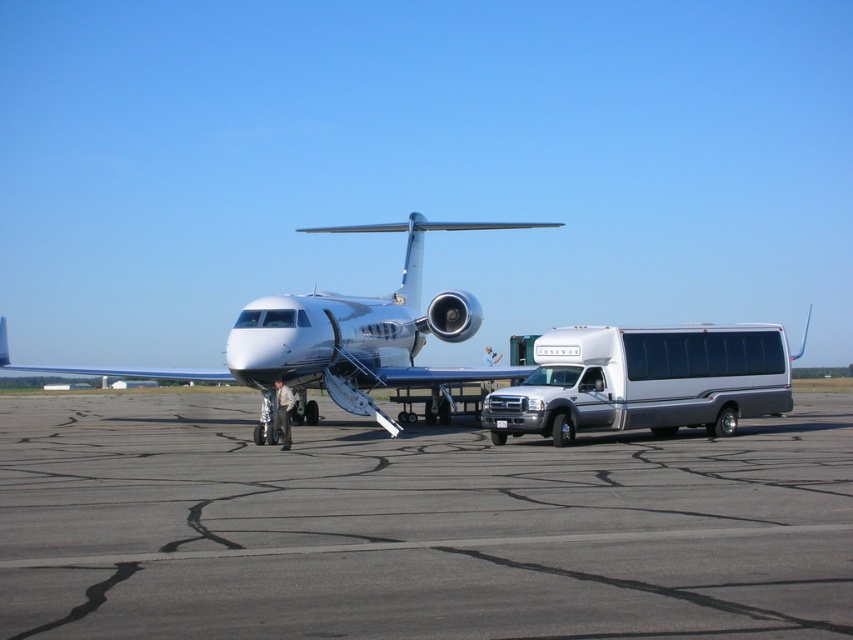
Question: Which point is farther to the camera?

Choices:
 (A) white metallic van at center
 (B) white glossy airplane at center

Answer: (B)

Question: Which object appears closest to the camera in this image?

Choices:
 (A) white metallic van at center
 (B) gray asphalt tarmac at center
 (C) white glossy airplane at center

Answer: (B)

Question: Can you confirm if white metallic van at center is bigger than white glossy airplane at center?

Choices:
 (A) yes
 (B) no

Answer: (B)

Question: Is gray asphalt tarmac at center closer to camera compared to white glossy airplane at center?

Choices:
 (A) no
 (B) yes

Answer: (B)

Question: Among these points, which one is nearest to the camera?

Choices:
 (A) (259, 321)
 (B) (531, 493)

Answer: (B)

Question: Is white metallic van at center thinner than white glossy airplane at center?

Choices:
 (A) yes
 (B) no

Answer: (A)